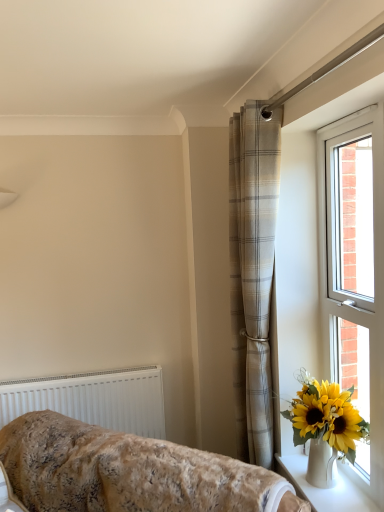
Question: From the image's perspective, is white ceramic vase at lower right positioned above or below white plastic window at right?

Choices:
 (A) below
 (B) above

Answer: (A)

Question: Is point (367, 498) positioned closer to the camera than point (332, 251)?

Choices:
 (A) closer
 (B) farther

Answer: (A)

Question: Which of these objects is positioned closest to the beige plaid curtain at center?

Choices:
 (A) white plastic window at right
 (B) white plastic radiator at lower left
 (C) fluffy beige blanket at lower left
 (D) white ceramic vase at lower right

Answer: (A)

Question: Which of these objects is positioned farthest from the white plastic window at right?

Choices:
 (A) white plastic radiator at lower left
 (B) fluffy beige blanket at lower left
 (C) white ceramic vase at lower right
 (D) beige plaid curtain at center

Answer: (A)